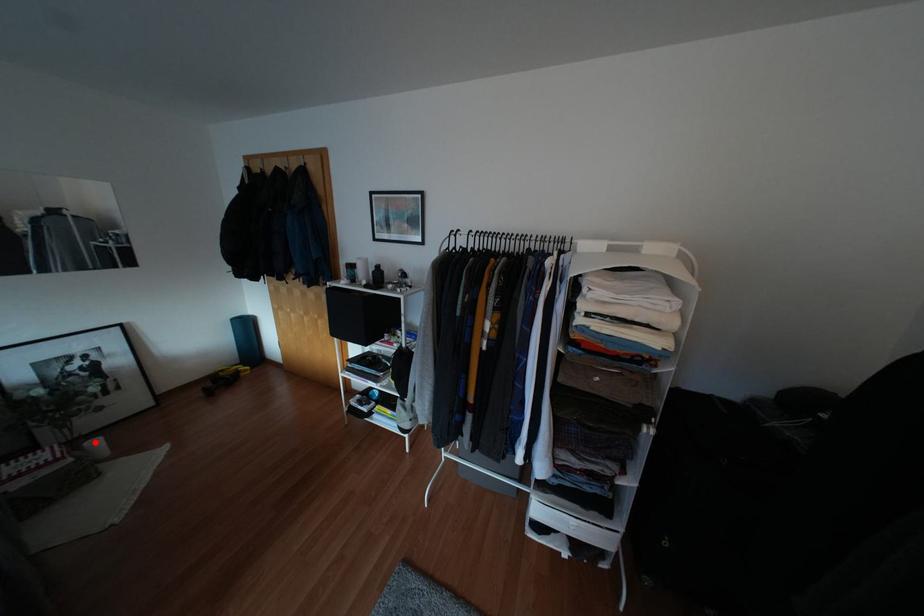
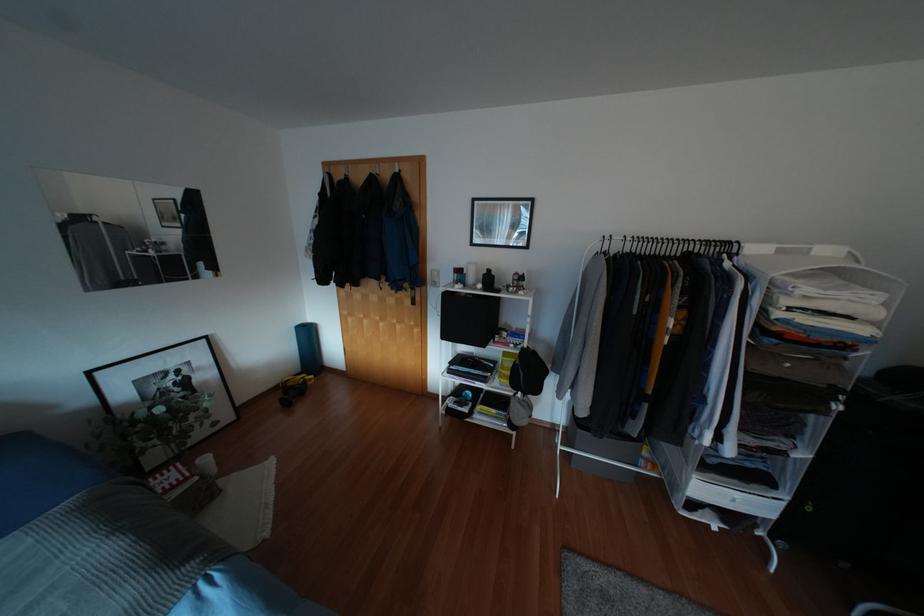
Find the pixel in the second image that matches the highlighted location in the first image.

(205, 459)